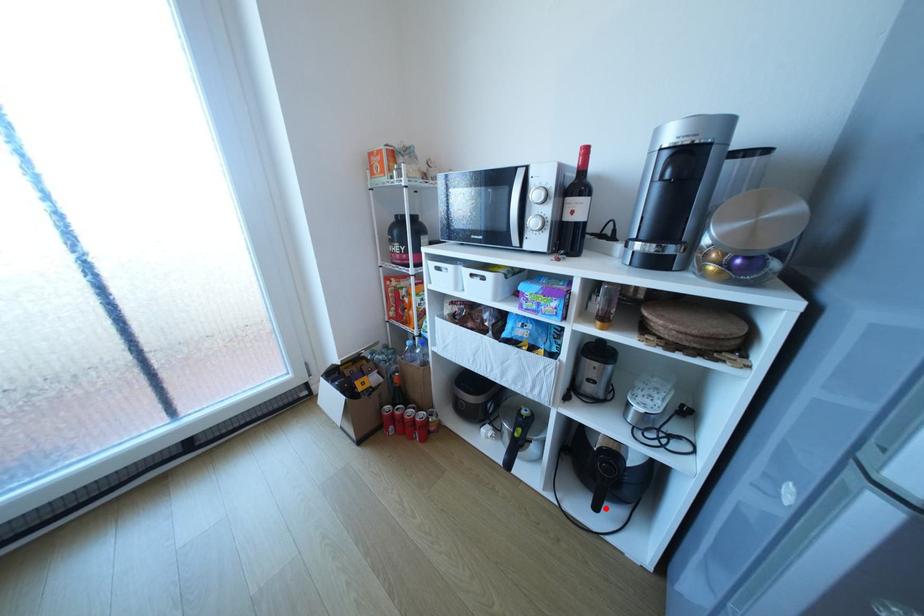
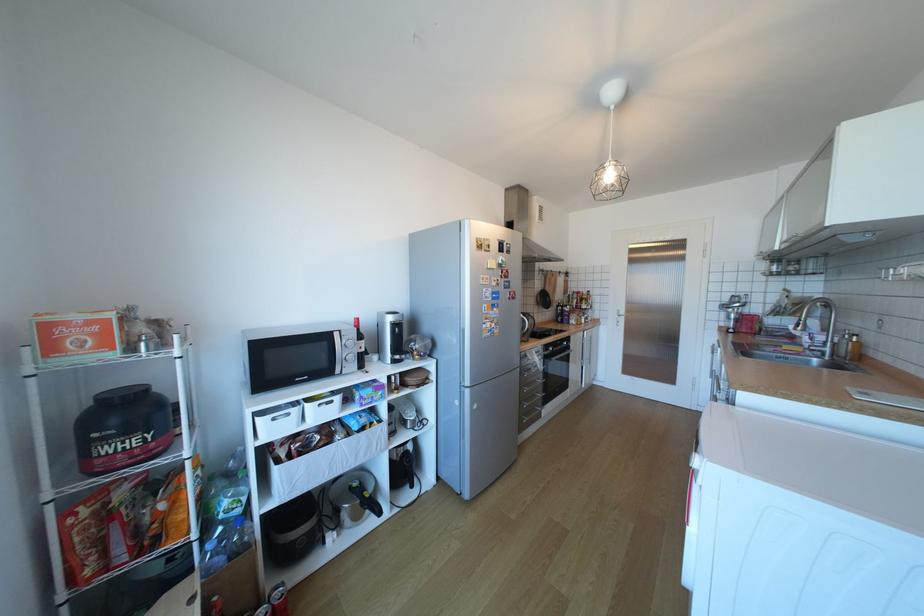
Question: A red point is marked in image1. In image2, is the corresponding 3D point closer to the camera or farther? Reply with the corresponding letter.

Choices:
 (A) The corresponding 3D point is closer.
 (B) The corresponding 3D point is farther.

Answer: (B)